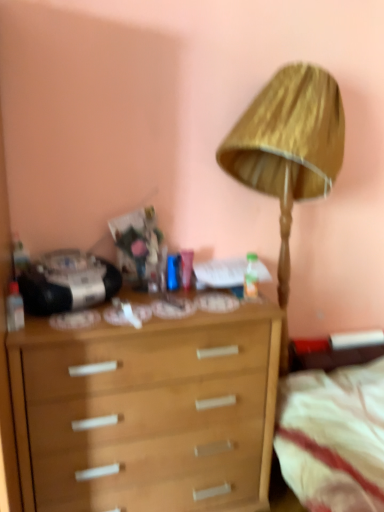
What do you see at coordinates (147, 411) in the screenshot? This screenshot has height=512, width=384. I see `wooden chest of drawers at center` at bounding box center [147, 411].

I want to click on wooden chest of drawers at center, so click(x=147, y=411).

I want to click on wooden chest of drawers at center, so click(x=147, y=411).